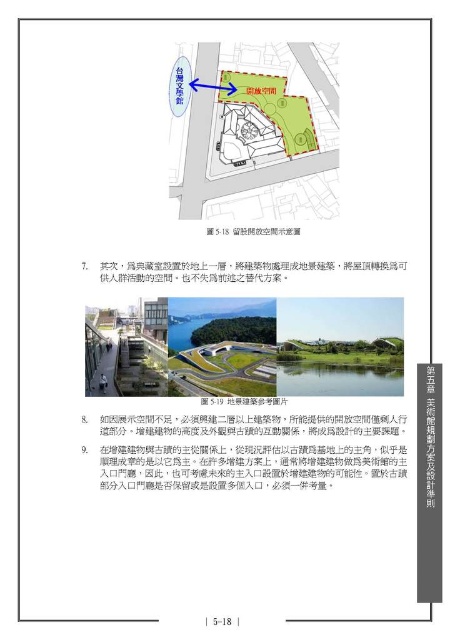
Question: Is green matte building at center further to camera compared to green reflective water at center?

Choices:
 (A) no
 (B) yes

Answer: (A)

Question: Is green matte building at center to the left of green reflective water at center from the viewer's perspective?

Choices:
 (A) yes
 (B) no

Answer: (A)

Question: Among these points, which one is farthest from the camera?

Choices:
 (A) (403, 385)
 (B) (284, 49)

Answer: (A)

Question: Does green matte building at center have a greater width compared to green reflective water at center?

Choices:
 (A) yes
 (B) no

Answer: (A)